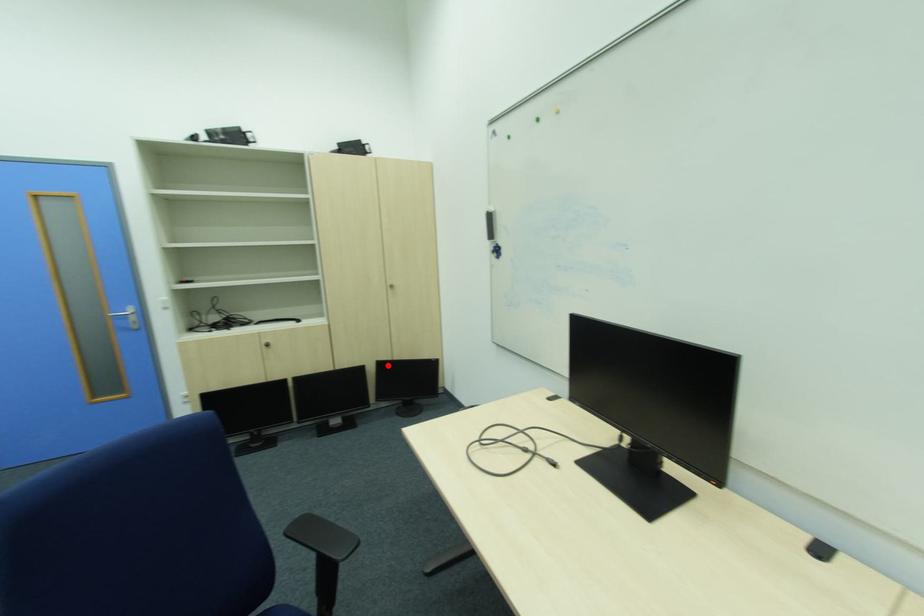
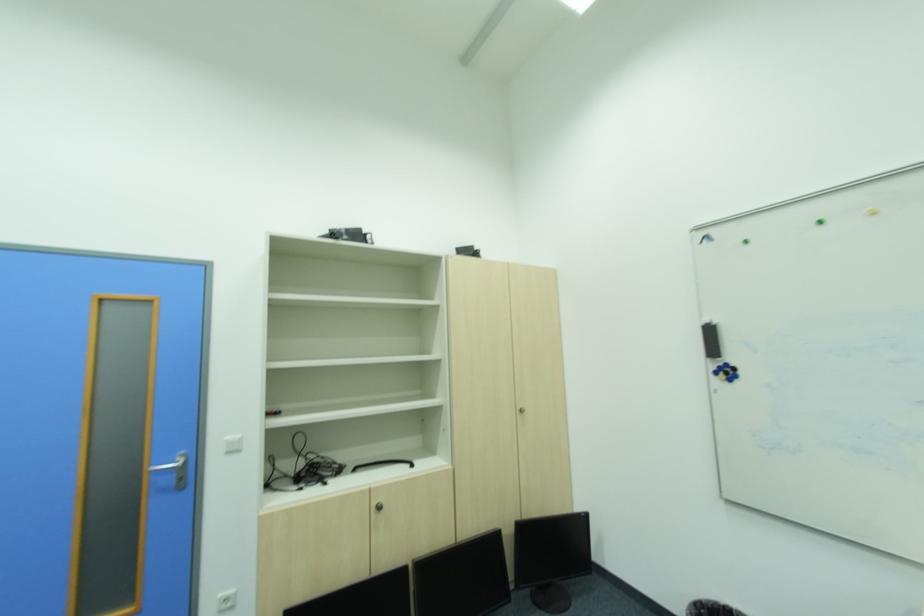
Find the pixel in the second image that matches the highlighted location in the first image.

(531, 531)